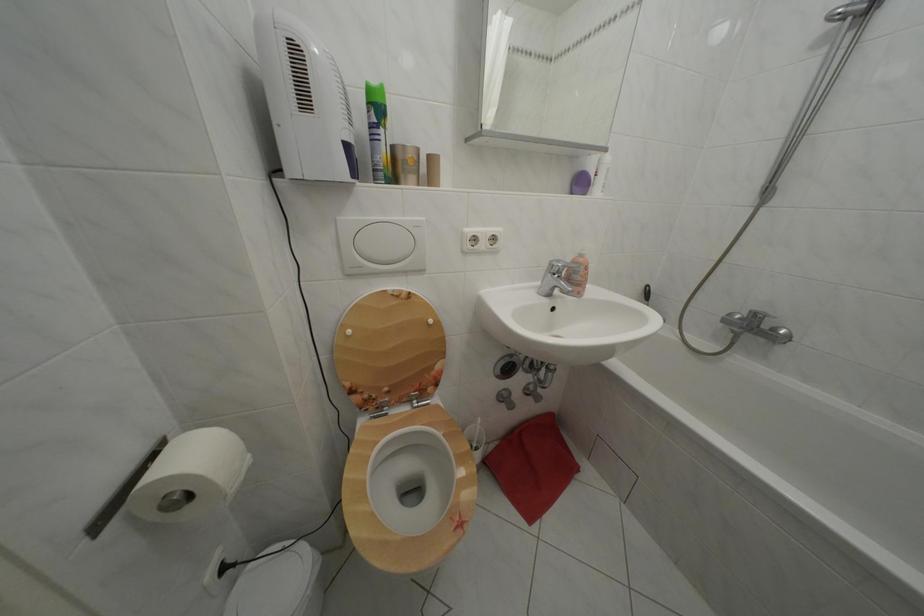
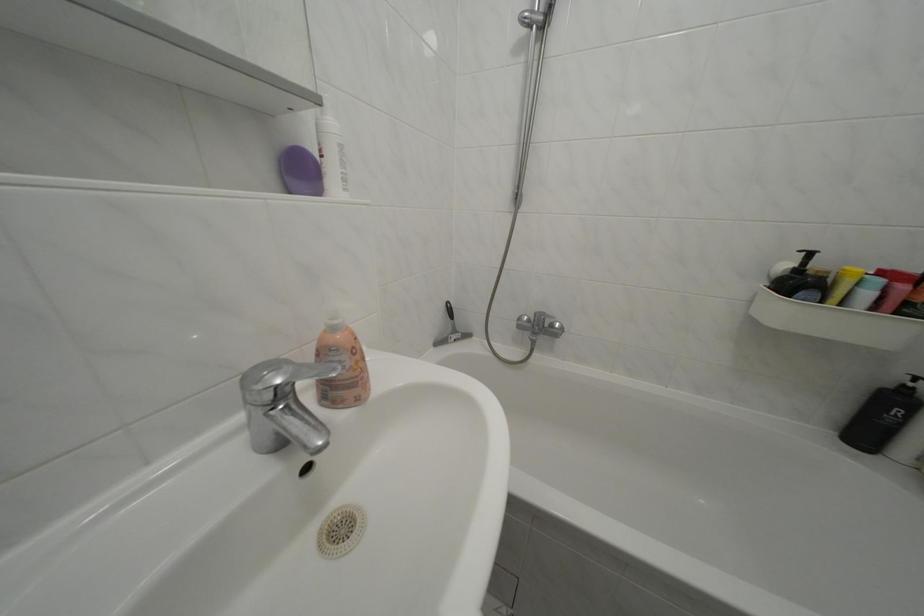
Locate, in the second image, the point that corresponds to the point at 590,262 in the first image.

(342, 334)